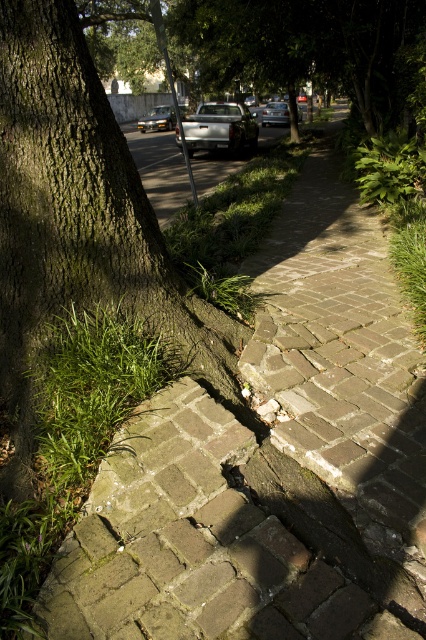
Measure the distance between point (400,44) and camera.

Point (400,44) is 10.46 meters from camera.

Can you confirm if green leafy tree at upper center is wider than silver metallic truck at center?

Indeed, green leafy tree at upper center has a greater width compared to silver metallic truck at center.

The height and width of the screenshot is (640, 426). In order to click on green leafy tree at upper center in this screenshot , I will do `click(313, 49)`.

This screenshot has width=426, height=640. Describe the element at coordinates (221, 128) in the screenshot. I see `silver metallic truck at center` at that location.

Which is more to the right, silver metallic truck at center or shiny silver sedan at center?

From the viewer's perspective, shiny silver sedan at center appears more on the right side.

The image size is (426, 640). What do you see at coordinates (221, 128) in the screenshot?
I see `silver metallic truck at center` at bounding box center [221, 128].

You are a GUI agent. You are given a task and a screenshot of the screen. Output one action in this format:
    pyautogui.click(x=<x>, y=<y>)
    Task: Click on the silver metallic truck at center
    
    Given the screenshot: What is the action you would take?
    pyautogui.click(x=221, y=128)

Is the position of brown rough tree trunk at left less distant than that of metallic silver sedan at center?

That is True.

Is brown rough tree trunk at left further to the viewer compared to metallic silver sedan at center?

No, it is not.

This screenshot has height=640, width=426. Describe the element at coordinates (80, 221) in the screenshot. I see `brown rough tree trunk at left` at that location.

Image resolution: width=426 pixels, height=640 pixels. I want to click on brown rough tree trunk at left, so click(x=80, y=221).